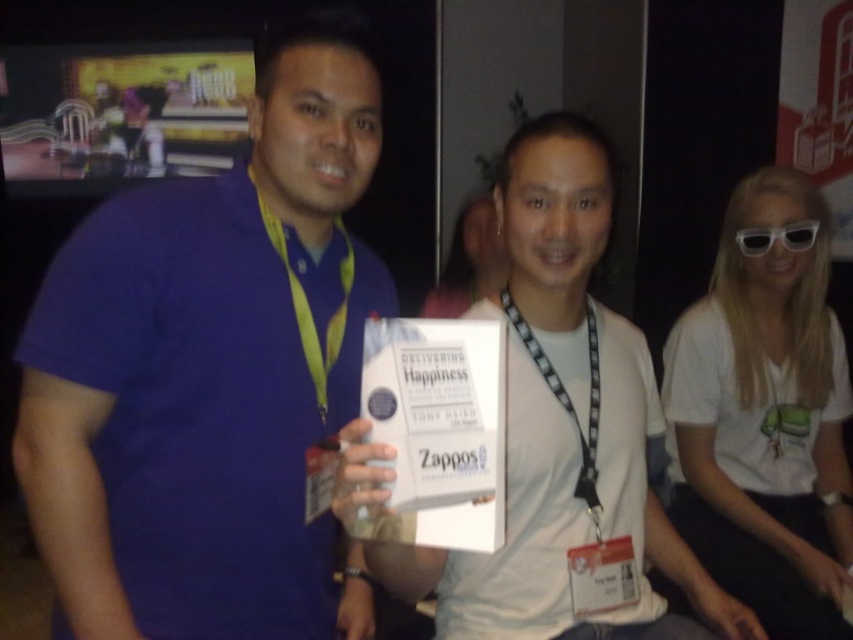
You are a photographer at the conference. You need to capture a photo that includes both the white matte book at center and the white plastic goggles at upper right. Which object should you position lower in the frame to ensure both are visible?

To include both the white matte book at center and the white plastic goggles at upper right in the photo, position the white matte book at center lower in the frame since it is already below the white plastic goggles at upper right.

You are a photographer at an event and need to capture a photo that includes both the matte blue shirt at left and the white plastic goggles at upper right. The camera you are using has a maximum focus range of 1.2 meters. Will you be able to include both objects in the same frame without moving the camera?

The distance between the matte blue shirt at left and the white plastic goggles at upper right is 1.14 meters, which is within the camera maximum focus range of 1.2 meters. Therefore, you can include both objects in the same frame without moving the camera.